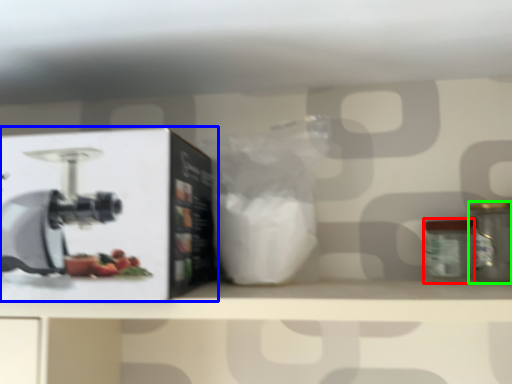
Question: Which object is positioned farthest from glass jar (highlighted by a red box)? Select from wide (highlighted by a blue box) and kitchen appliance (highlighted by a green box).

Choices:
 (A) wide
 (B) kitchen appliance

Answer: (A)